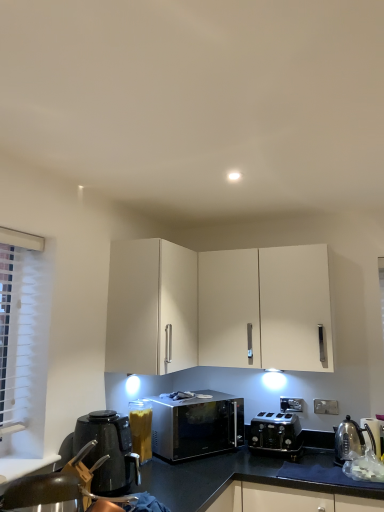
Question: Is clear plastic container at center, which ranks as the 1th appliance in left-to-right order, not within white matte cabinet at upper center?

Choices:
 (A) yes
 (B) no

Answer: (A)

Question: From a real-world perspective, is clear plastic container at center, which ranks as the 1th appliance in left-to-right order, physically above white matte cabinet at upper center?

Choices:
 (A) yes
 (B) no

Answer: (B)

Question: Does clear plastic container at center, positioned as the third appliance in right-to-left order, turn towards white matte cabinet at upper center?

Choices:
 (A) no
 (B) yes

Answer: (A)

Question: Can you confirm if clear plastic container at center, positioned as the third appliance in right-to-left order, is positioned to the left of white matte cabinet at upper center?

Choices:
 (A) yes
 (B) no

Answer: (A)

Question: Considering the relative sizes of clear plastic container at center, positioned as the third appliance in right-to-left order, and white matte cabinet at upper center in the image provided, is clear plastic container at center, positioned as the third appliance in right-to-left order, bigger than white matte cabinet at upper center?

Choices:
 (A) yes
 (B) no

Answer: (B)

Question: Does clear plastic container at center, which ranks as the 1th appliance in left-to-right order, lie behind white matte cabinet at upper center?

Choices:
 (A) no
 (B) yes

Answer: (B)

Question: Considering the relative sizes of white matte cabinet at upper center and clear plastic container at center, positioned as the third appliance in right-to-left order, in the image provided, is white matte cabinet at upper center bigger than clear plastic container at center, positioned as the third appliance in right-to-left order,?

Choices:
 (A) yes
 (B) no

Answer: (A)

Question: Is white matte cabinet at upper center surrounding clear plastic container at center, which ranks as the 1th appliance in left-to-right order?

Choices:
 (A) no
 (B) yes

Answer: (A)

Question: From a real-world perspective, does white matte cabinet at upper center sit lower than clear plastic container at center, positioned as the third appliance in right-to-left order?

Choices:
 (A) no
 (B) yes

Answer: (A)

Question: Is white matte cabinet at upper center taller than clear plastic container at center, which ranks as the 1th appliance in left-to-right order?

Choices:
 (A) no
 (B) yes

Answer: (B)

Question: Can you confirm if white matte cabinet at upper center is positioned to the left of clear plastic container at center, positioned as the third appliance in right-to-left order?

Choices:
 (A) yes
 (B) no

Answer: (B)

Question: From the image's perspective, would you say white matte cabinet at upper center is shown under clear plastic container at center, which ranks as the 1th appliance in left-to-right order?

Choices:
 (A) no
 (B) yes

Answer: (A)

Question: Are sleek metallic microwave at center and metallic silver kettle at right, which is the 1th appliance from right to left, far apart?

Choices:
 (A) yes
 (B) no

Answer: (B)